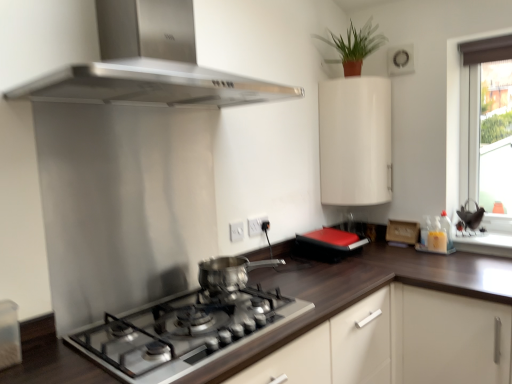
Find the location of a particular element. The height and width of the screenshot is (384, 512). free space in front of polished silver pot at center is located at coordinates (219, 294).